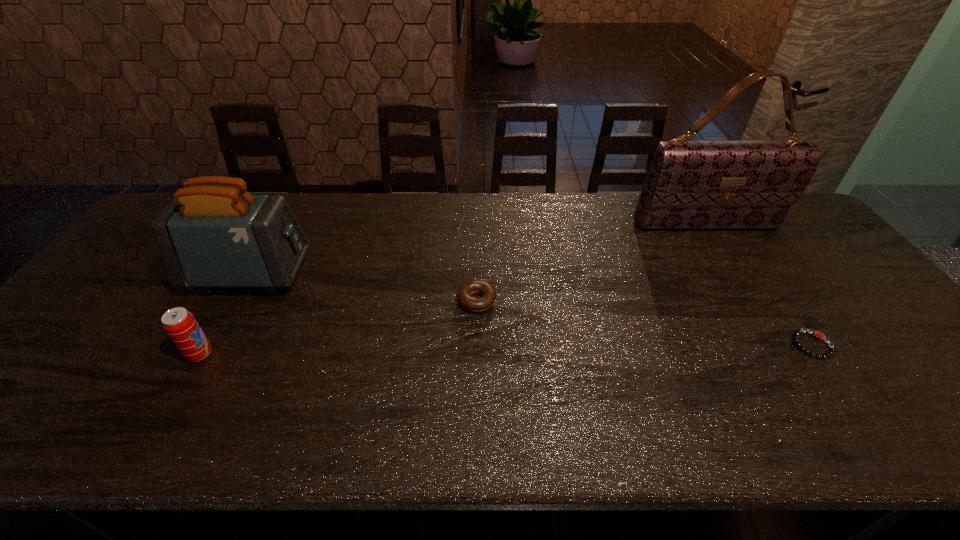
At what (x,y) coordinates should I click in order to perform the action: click on free region located on the back of the fourth tallest object. Please return your answer as a coordinate pair (x, y). The height and width of the screenshot is (540, 960). Looking at the image, I should click on (477, 259).

Locate an element on the screen. vacant space located on the back of the bracelet is located at coordinates (762, 273).

You are a GUI agent. You are given a task and a screenshot of the screen. Output one action in this format:
    pyautogui.click(x=<x>, y=<y>)
    Task: Click on the object that is at the far edge
    This screenshot has width=960, height=540.
    Given the screenshot: What is the action you would take?
    pyautogui.click(x=690, y=184)

At what (x,y) coordinates should I click in order to perform the action: click on object at the right edge. Please return your answer as a coordinate pair (x, y). Looking at the image, I should click on (690, 184).

Identify the location of object at the far right corner. The height and width of the screenshot is (540, 960). (690, 184).

Where is `free location at the far edge`? free location at the far edge is located at coordinates (592, 207).

Where is `vacant space at the near edge of the desktop`? vacant space at the near edge of the desktop is located at coordinates (174, 418).

The image size is (960, 540). What are the coordinates of `vacant space at the right edge of the desktop` in the screenshot? It's located at (847, 293).

This screenshot has height=540, width=960. Identify the location of vacant space at the near left corner. (42, 422).

The width and height of the screenshot is (960, 540). In order to click on free space at the near right corner of the desktop in this screenshot , I will do `click(920, 434)`.